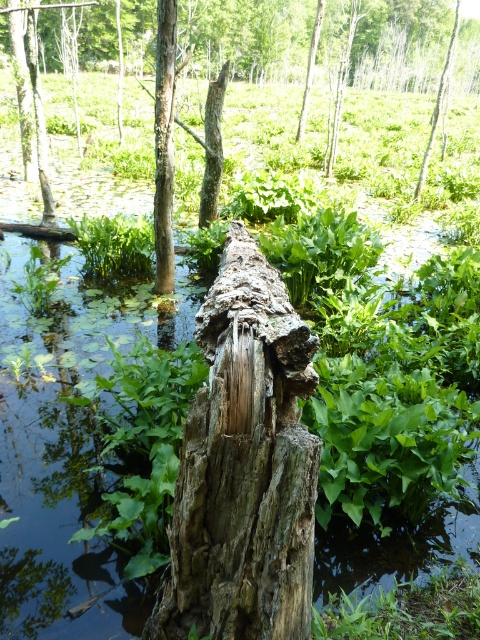
Question: From the image, what is the correct spatial relationship of weathered wood stump at center in relation to smooth bark tree trunk at center?

Choices:
 (A) right
 (B) left

Answer: (A)

Question: Which object is farther from the camera taking this photo?

Choices:
 (A) weathered wood stump at center
 (B) smooth bark tree trunk at center

Answer: (B)

Question: Can you confirm if weathered wood stump at center is bigger than smooth bark tree trunk at center?

Choices:
 (A) no
 (B) yes

Answer: (A)

Question: Does weathered wood stump at center appear over smooth bark tree trunk at center?

Choices:
 (A) yes
 (B) no

Answer: (B)

Question: Which object appears closest to the camera in this image?

Choices:
 (A) smooth bark tree trunk at center
 (B) weathered wood stump at center

Answer: (B)